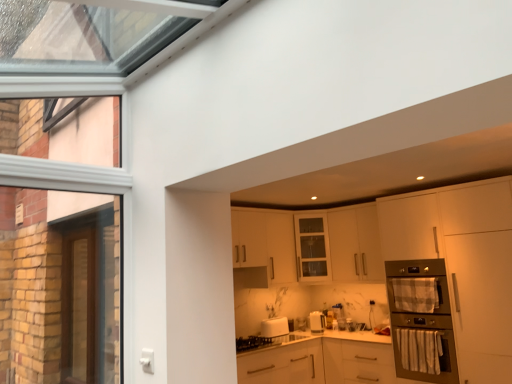
Locate an element on the screen. The height and width of the screenshot is (384, 512). empty space that is ontop of plaid fabric oven door at right is located at coordinates (x=408, y=274).